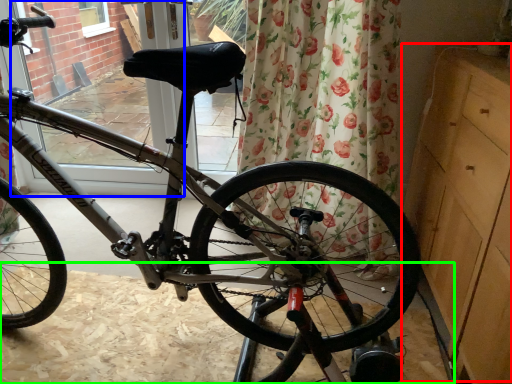
Question: Which object is positioned closest to dresser (highlighted by a red box)? Select from screen door (highlighted by a blue box) and dirt track (highlighted by a green box).

Choices:
 (A) screen door
 (B) dirt track

Answer: (B)